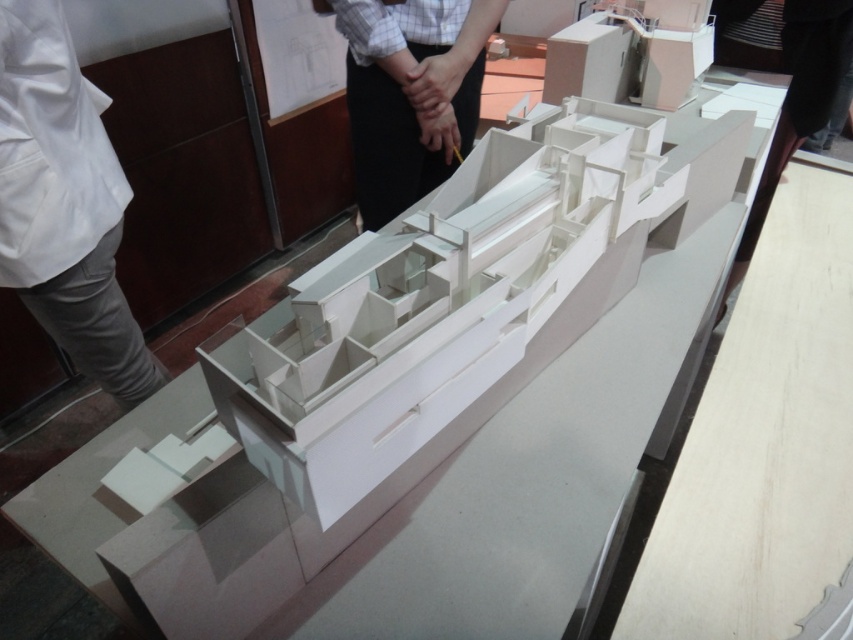
You are an architect examining the architectural model on the glass table. You notice the white cotton pants at lower left and the white paper at upper center. Which object is narrower in width?

The white cotton pants at lower left is thinner than the white paper at upper center, so the white cotton pants at lower left is narrower in width.

You are an architect reviewing the model and notice the white cotton pants at lower left and the white paper at upper center. Which object is taller in the scene?

The white cotton pants at lower left is taller than the white paper at upper center according to the description.

You are an architect reviewing the model and need to place a 60 cm long ruler between the white cotton pants at lower left and the white paper at upper center. Will the ruler fit between them without overlapping either object?

The distance between the white cotton pants at lower left and the white paper at upper center is 68.26 centimeters. Since the ruler is 60 cm long, it will fit between them without overlapping either object as there is sufficient space.